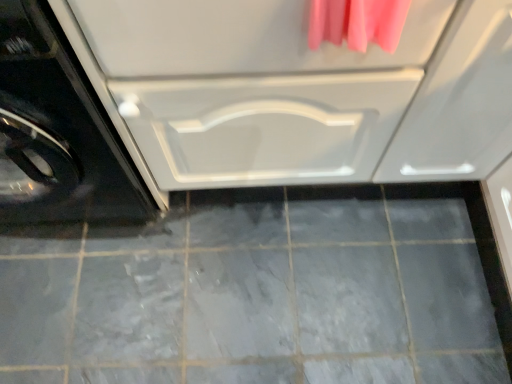
Question: Does white glossy drawer at center turn towards black glossy washing machine at left?

Choices:
 (A) yes
 (B) no

Answer: (B)

Question: From the image's perspective, is white glossy drawer at center under black glossy washing machine at left?

Choices:
 (A) yes
 (B) no

Answer: (B)

Question: Does white glossy drawer at center have a smaller size compared to black glossy washing machine at left?

Choices:
 (A) yes
 (B) no

Answer: (B)

Question: Is white glossy drawer at center outside black glossy washing machine at left?

Choices:
 (A) yes
 (B) no

Answer: (A)

Question: Considering the relative sizes of white glossy drawer at center and black glossy washing machine at left in the image provided, is white glossy drawer at center bigger than black glossy washing machine at left?

Choices:
 (A) no
 (B) yes

Answer: (B)

Question: From a real-world perspective, relative to black glossy washing machine at left, is gray matte tile at center vertically above or below?

Choices:
 (A) below
 (B) above

Answer: (A)

Question: Considering their positions, is gray matte tile at center located in front of or behind black glossy washing machine at left?

Choices:
 (A) front
 (B) behind

Answer: (B)

Question: Is gray matte tile at center to the left or to the right of black glossy washing machine at left in the image?

Choices:
 (A) right
 (B) left

Answer: (A)

Question: In terms of width, does gray matte tile at center look wider or thinner when compared to black glossy washing machine at left?

Choices:
 (A) thin
 (B) wide

Answer: (B)

Question: Is point (41, 193) closer or farther from the camera than point (326, 218)?

Choices:
 (A) closer
 (B) farther

Answer: (A)

Question: Looking at their shapes, would you say black glossy washing machine at left is wider or thinner than gray matte tile at center?

Choices:
 (A) thin
 (B) wide

Answer: (A)

Question: Do you think black glossy washing machine at left is within gray matte tile at center, or outside of it?

Choices:
 (A) outside
 (B) inside

Answer: (A)

Question: Is black glossy washing machine at left to the left or to the right of gray matte tile at center in the image?

Choices:
 (A) left
 (B) right

Answer: (A)

Question: From the image's perspective, is black glossy washing machine at left above or below white glossy drawer at center?

Choices:
 (A) above
 (B) below

Answer: (B)

Question: Would you say black glossy washing machine at left is inside or outside white glossy drawer at center?

Choices:
 (A) outside
 (B) inside

Answer: (A)